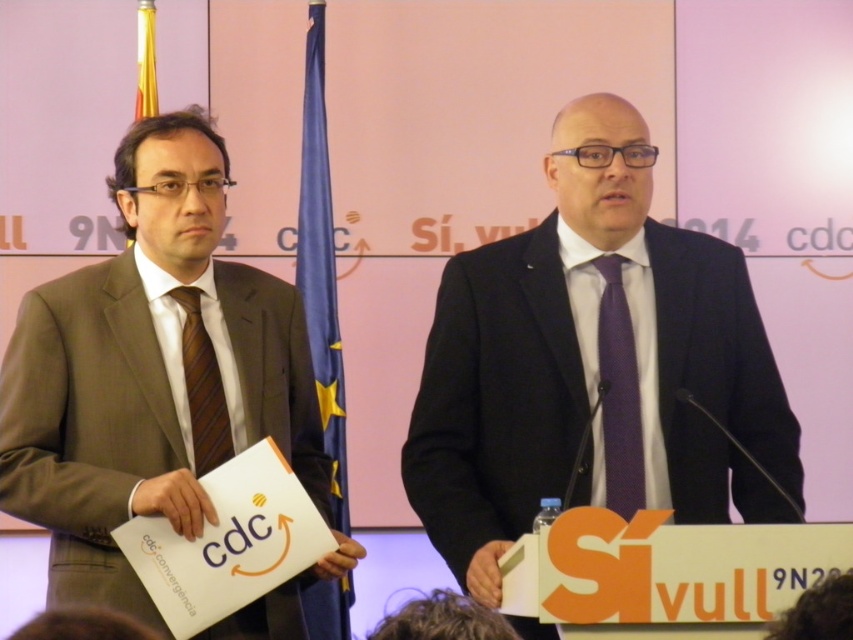
Which is above, brown suit at left or purple silk tie at center?

brown suit at left

Who is positioned more to the right, brown suit at left or purple silk tie at center?

purple silk tie at center is more to the right.

Is point (4, 387) more distant than point (639, 397)?

No, it is in front of (639, 397).

Find the location of a particular element. Image resolution: width=853 pixels, height=640 pixels. brown suit at left is located at coordinates (151, 372).

Between matte black suit at center and purple silk tie at center, which one is positioned higher?

matte black suit at center is higher up.

Does matte black suit at center come in front of purple silk tie at center?

Yes, it is.

Who is more distant from viewer, (520, 481) or (633, 467)?

The point (520, 481) is behind.

You are a GUI agent. You are given a task and a screenshot of the screen. Output one action in this format:
    pyautogui.click(x=<x>, y=<y>)
    Task: Click on the matte black suit at center
    This screenshot has width=853, height=640.
    Given the screenshot: What is the action you would take?
    pyautogui.click(x=593, y=365)

Does purple silk tie at center come in front of brownstriped fabrictie at left?

Yes, purple silk tie at center is in front of brownstriped fabrictie at left.

What do you see at coordinates (619, 394) in the screenshot?
I see `purple silk tie at center` at bounding box center [619, 394].

You are a GUI agent. You are given a task and a screenshot of the screen. Output one action in this format:
    pyautogui.click(x=<x>, y=<y>)
    Task: Click on the purple silk tie at center
    
    Given the screenshot: What is the action you would take?
    pyautogui.click(x=619, y=394)